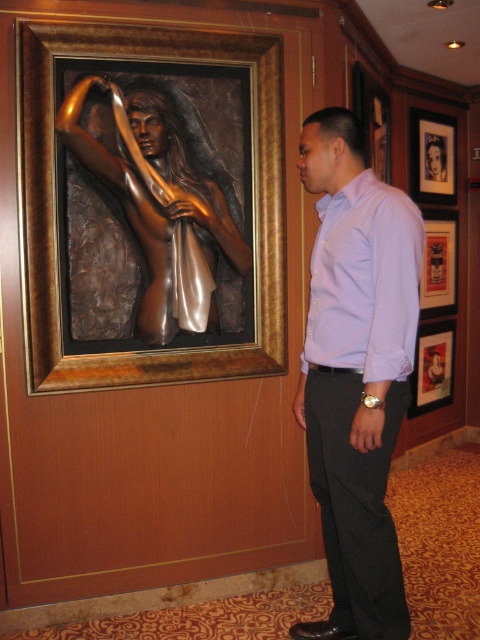
Question: Can you confirm if matte black picture frame at upper right is positioned to the right of wooden picture frame at right?

Choices:
 (A) yes
 (B) no

Answer: (B)

Question: Estimate the real-world distances between objects in this image. Which object is farther from the purple cotton shirt at center?

Choices:
 (A) matte black picture frame at upper right
 (B) bronze sculpture at upper center
 (C) wooden picture frame at right

Answer: (B)

Question: Does matte black picture frame at lower right lie behind wooden picture frame at right?

Choices:
 (A) no
 (B) yes

Answer: (B)

Question: Does purple cotton shirt at center have a larger size compared to bronze sculpture at upper center?

Choices:
 (A) no
 (B) yes

Answer: (B)

Question: Which of the following is the farthest from the observer?

Choices:
 (A) (418, 163)
 (B) (408, 406)
 (C) (36, 280)

Answer: (A)

Question: Which point is closer to the camera taking this photo?

Choices:
 (A) (x=448, y=333)
 (B) (x=418, y=243)

Answer: (B)